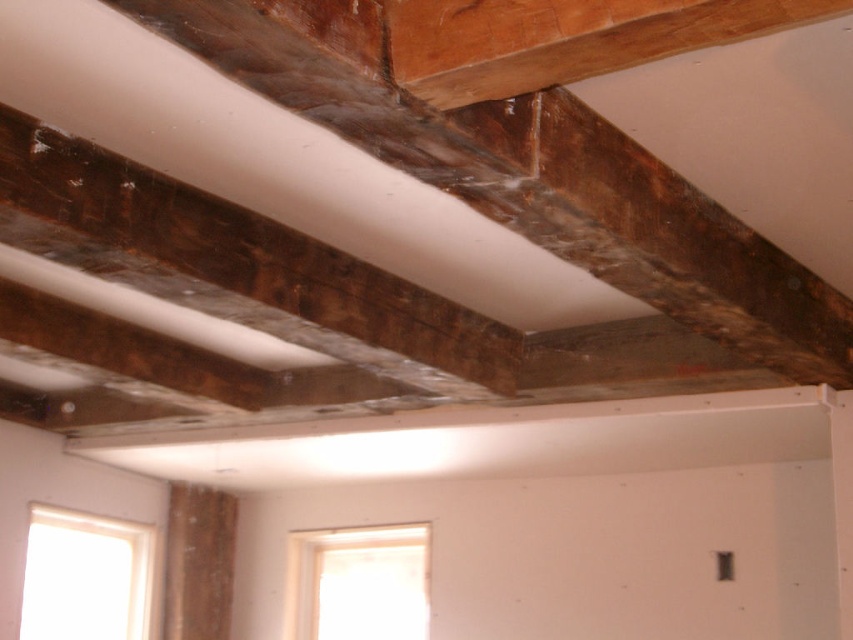
Question: Which point is closer to the camera taking this photo?

Choices:
 (A) (636, 195)
 (B) (289, 262)

Answer: (A)

Question: Can you confirm if dark brown wood beam at upper center is positioned below dark brown wood at upper center?

Choices:
 (A) yes
 (B) no

Answer: (B)

Question: Among these objects, which one is nearest to the camera?

Choices:
 (A) dark brown wood beam at upper center
 (B) dark brown wood at upper center

Answer: (A)

Question: Where is dark brown wood beam at upper center located in relation to dark brown wood at upper center in the image?

Choices:
 (A) right
 (B) left

Answer: (A)

Question: Among these objects, which one is farthest from the camera?

Choices:
 (A) dark brown wood at upper center
 (B) dark brown wood beam at upper center

Answer: (A)

Question: Can you confirm if dark brown wood beam at upper center is positioned above dark brown wood at upper center?

Choices:
 (A) yes
 (B) no

Answer: (A)